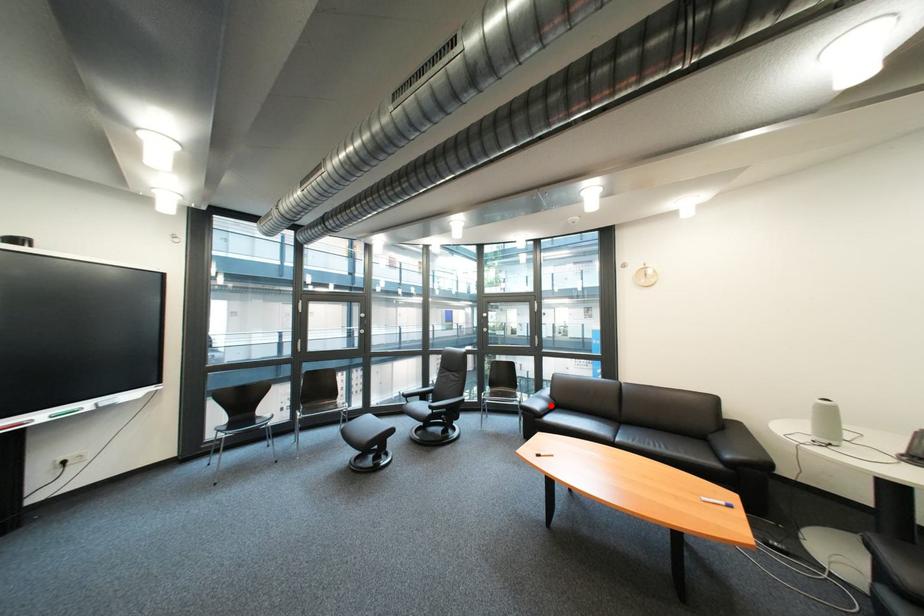
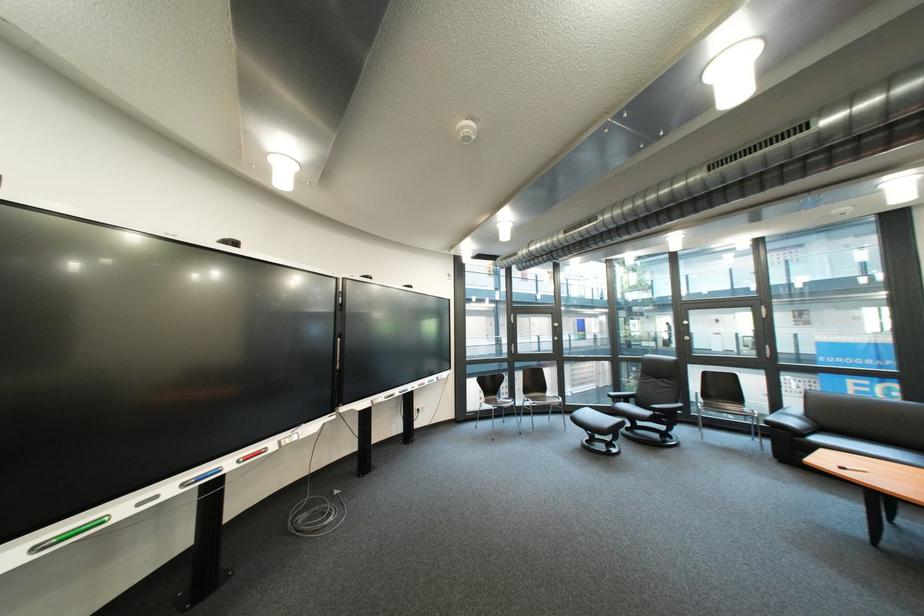
In the second image, find the point that corresponds to the highlighted location in the first image.

(806, 423)